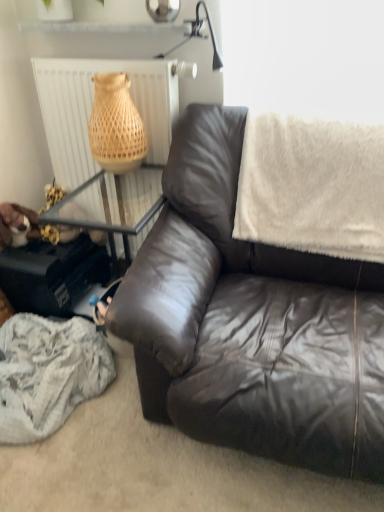
Question: Is white fluffy blanket at upper right surrounded by white textured radiator at upper left?

Choices:
 (A) yes
 (B) no

Answer: (B)

Question: Considering the relative sizes of white textured radiator at upper left and white fluffy blanket at upper right in the image provided, is white textured radiator at upper left bigger than white fluffy blanket at upper right?

Choices:
 (A) no
 (B) yes

Answer: (B)

Question: From the image's perspective, does white textured radiator at upper left appear higher than white fluffy blanket at upper right?

Choices:
 (A) no
 (B) yes

Answer: (B)

Question: Are white textured radiator at upper left and white fluffy blanket at upper right beside each other?

Choices:
 (A) no
 (B) yes

Answer: (A)

Question: Considering the relative sizes of white textured radiator at upper left and white fluffy blanket at upper right in the image provided, is white textured radiator at upper left smaller than white fluffy blanket at upper right?

Choices:
 (A) yes
 (B) no

Answer: (B)

Question: Considering the positions of point (306, 201) and point (342, 463), is point (306, 201) closer or farther from the camera than point (342, 463)?

Choices:
 (A) closer
 (B) farther

Answer: (B)

Question: From a real-world perspective, is white fluffy blanket at upper right positioned above or below matte brown leather couch at center?

Choices:
 (A) above
 (B) below

Answer: (A)

Question: Visually, is white fluffy blanket at upper right positioned to the left or to the right of matte brown leather couch at center?

Choices:
 (A) left
 (B) right

Answer: (B)

Question: Considering their positions, is white fluffy blanket at upper right located in front of or behind matte brown leather couch at center?

Choices:
 (A) front
 (B) behind

Answer: (B)

Question: Considering their positions, is white textured radiator at upper left located in front of or behind white fluffy blanket at upper right?

Choices:
 (A) front
 (B) behind

Answer: (B)

Question: Considering the positions of white textured radiator at upper left and white fluffy blanket at upper right in the image, is white textured radiator at upper left taller or shorter than white fluffy blanket at upper right?

Choices:
 (A) tall
 (B) short

Answer: (A)

Question: Is white textured radiator at upper left bigger or smaller than white fluffy blanket at upper right?

Choices:
 (A) small
 (B) big

Answer: (B)

Question: From the image's perspective, is white textured radiator at upper left positioned above or below white fluffy blanket at upper right?

Choices:
 (A) below
 (B) above

Answer: (B)

Question: Considering the positions of matte brown leather couch at center and white textured radiator at upper left in the image, is matte brown leather couch at center taller or shorter than white textured radiator at upper left?

Choices:
 (A) short
 (B) tall

Answer: (A)

Question: Which is correct: matte brown leather couch at center is inside white textured radiator at upper left, or outside of it?

Choices:
 (A) outside
 (B) inside

Answer: (A)